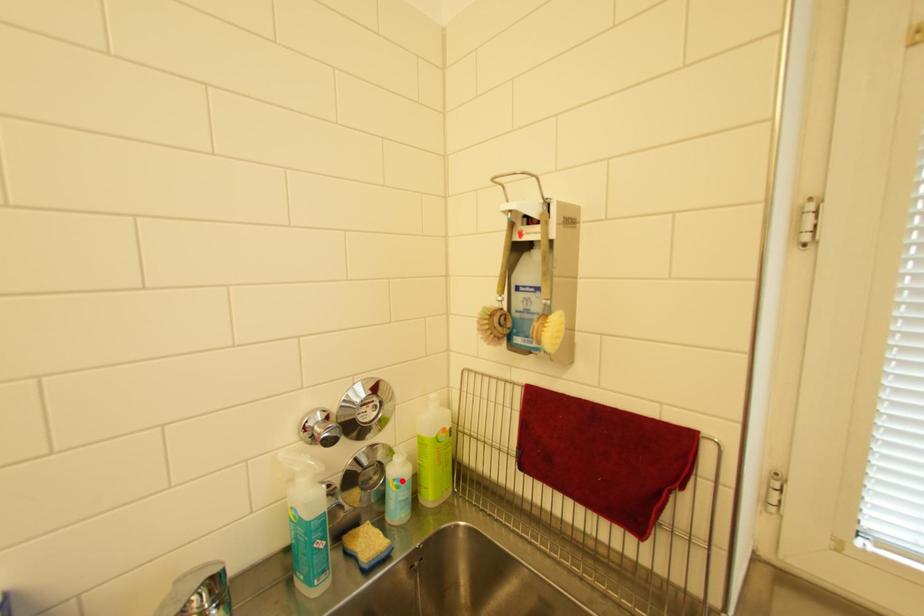
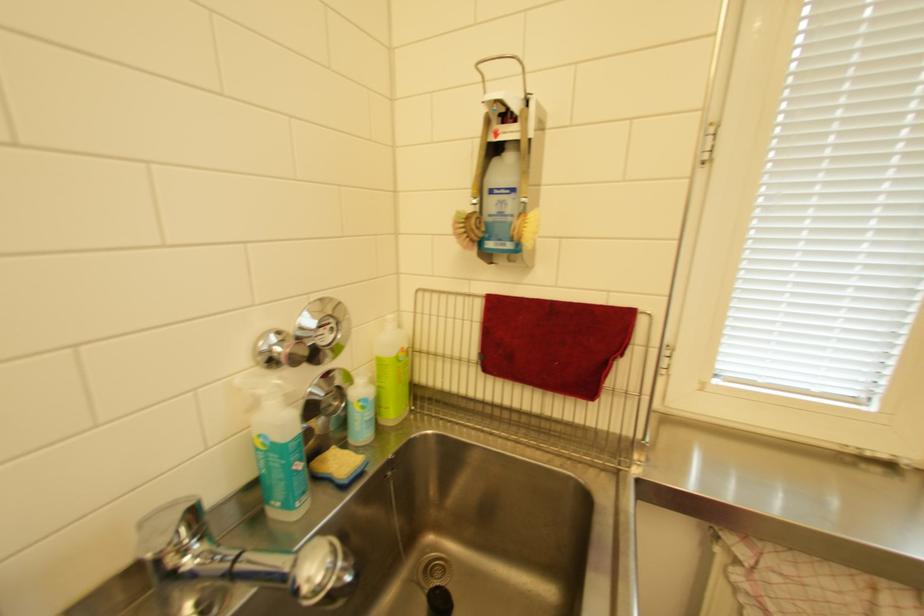
The point at the highlighted location is marked in the first image. Where is the corresponding point in the second image?

(367, 400)